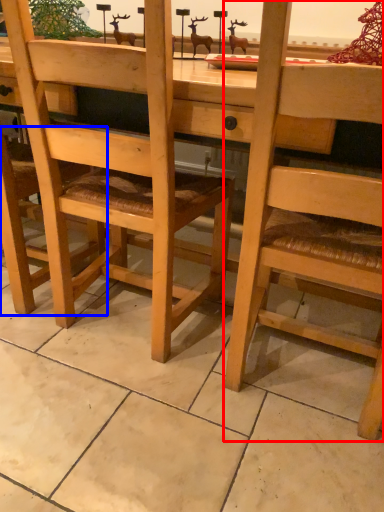
Question: Which of the following is the closest to the observer, chair (highlighted by a red box) or chair (highlighted by a blue box)?

Choices:
 (A) chair
 (B) chair

Answer: (A)